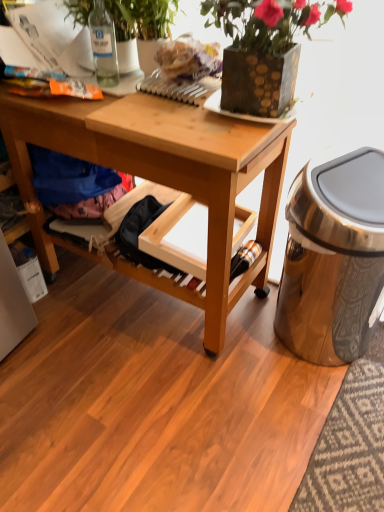
Question: Is matte plastic bag at upper center positioned far away from textured brown vase at upper center, the second houseplant from the left?

Choices:
 (A) no
 (B) yes

Answer: (A)

Question: Is matte plastic bag at upper center facing towards textured brown vase at upper center, the second houseplant from the left?

Choices:
 (A) no
 (B) yes

Answer: (A)

Question: Can you confirm if matte plastic bag at upper center is positioned to the right of textured brown vase at upper center, the first houseplant in the right-to-left sequence?

Choices:
 (A) yes
 (B) no

Answer: (B)

Question: From a real-world perspective, does matte plastic bag at upper center sit lower than textured brown vase at upper center, the first houseplant in the right-to-left sequence?

Choices:
 (A) no
 (B) yes

Answer: (B)

Question: Can you confirm if matte plastic bag at upper center is taller than textured brown vase at upper center, the second houseplant from the left?

Choices:
 (A) no
 (B) yes

Answer: (A)

Question: Based on their sizes in the image, would you say green leafy plant at upper center, positioned as the second houseplant in right-to-left order, is bigger or smaller than wooden desk at center?

Choices:
 (A) big
 (B) small

Answer: (B)

Question: From their relative heights in the image, would you say green leafy plant at upper center, the 1th houseplant positioned from the left, is taller or shorter than wooden desk at center?

Choices:
 (A) tall
 (B) short

Answer: (B)

Question: Considering the positions of green leafy plant at upper center, the 1th houseplant positioned from the left, and wooden desk at center in the image, is green leafy plant at upper center, the 1th houseplant positioned from the left, wider or thinner than wooden desk at center?

Choices:
 (A) wide
 (B) thin

Answer: (B)

Question: Considering the positions of point (77, 11) and point (210, 307), is point (77, 11) closer or farther from the camera than point (210, 307)?

Choices:
 (A) closer
 (B) farther

Answer: (A)

Question: From a real-world perspective, is polished metallic trash can at right positioned above or below wooden drawer at center?

Choices:
 (A) above
 (B) below

Answer: (A)

Question: Is polished metallic trash can at right situated inside wooden drawer at center or outside?

Choices:
 (A) outside
 (B) inside

Answer: (A)

Question: Considering the relative positions of polished metallic trash can at right and wooden drawer at center in the image provided, is polished metallic trash can at right to the left or to the right of wooden drawer at center?

Choices:
 (A) left
 (B) right

Answer: (B)

Question: Considering the positions of polished metallic trash can at right and wooden drawer at center in the image, is polished metallic trash can at right taller or shorter than wooden drawer at center?

Choices:
 (A) short
 (B) tall

Answer: (B)

Question: Is blue fabric at lower left taller or shorter than wooden drawer at center?

Choices:
 (A) tall
 (B) short

Answer: (A)

Question: From a real-world perspective, is blue fabric at lower left physically located above or below wooden drawer at center?

Choices:
 (A) above
 (B) below

Answer: (A)